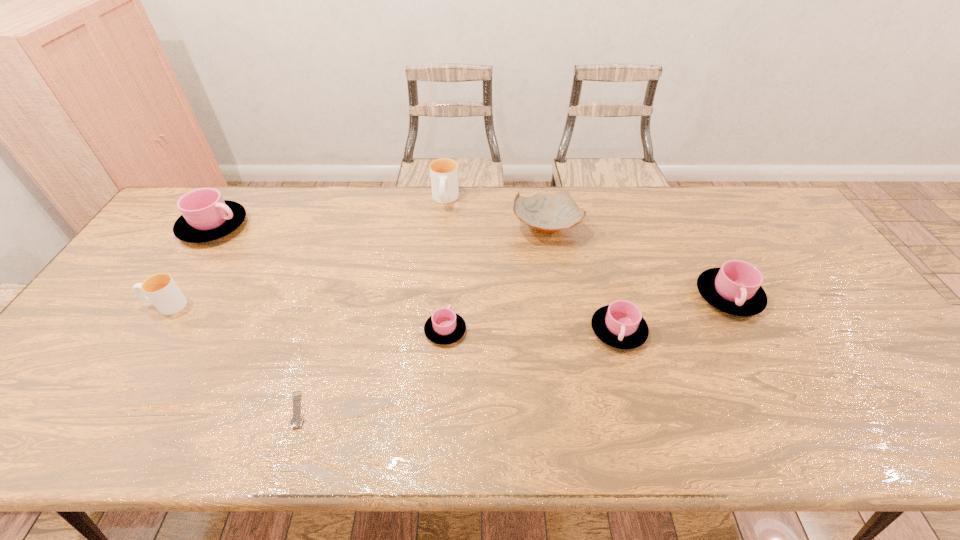
At what (x,y) coordinates should I click in order to perform the action: click on vacant space that's between the second biggest pink cup and the smallest pink cup. Please return your answer as a coordinate pair (x, y). The image size is (960, 540). Looking at the image, I should click on (587, 313).

At what (x,y) coordinates should I click in order to perform the action: click on vacant area between the nearer yellow cup and the fifth cup from left to right. Please return your answer as a coordinate pair (x, y). Image resolution: width=960 pixels, height=540 pixels. Looking at the image, I should click on (393, 318).

The height and width of the screenshot is (540, 960). I want to click on vacant area that lies between the seventh tallest object and the nearest object, so click(372, 370).

At what (x,y) coordinates should I click in order to perform the action: click on object that ranks as the seventh closest to the pottery. Please return your answer as a coordinate pair (x, y). Looking at the image, I should click on pyautogui.click(x=161, y=290).

Where is `object that stands as the second closest to the right yellow cup`? The height and width of the screenshot is (540, 960). object that stands as the second closest to the right yellow cup is located at coordinates (444, 327).

Where is `cup that is the nearest to the third pink cup from right to left`? The height and width of the screenshot is (540, 960). cup that is the nearest to the third pink cup from right to left is located at coordinates (620, 325).

Locate an element on the screen. cup that is the closest to the third pink cup from right to left is located at coordinates (620, 325).

Choose which pink cup is the third nearest neighbor to the pottery. Please provide its 2D coordinates. Your answer should be formatted as a tuple, i.e. [(x, y)], where the tuple contains the x and y coordinates of a point satisfying the conditions above.

[(444, 327)]

Choose which pink cup is the third nearest neighbor to the seventh tallest object. Please provide its 2D coordinates. Your answer should be formatted as a tuple, i.e. [(x, y)], where the tuple contains the x and y coordinates of a point satisfying the conditions above.

[(206, 216)]

Locate an element on the screen. The width and height of the screenshot is (960, 540). vacant space that satisfies the following two spatial constraints: 1. on the side with the handle of the watch; 2. on the right side of the biggest pink cup is located at coordinates (94, 409).